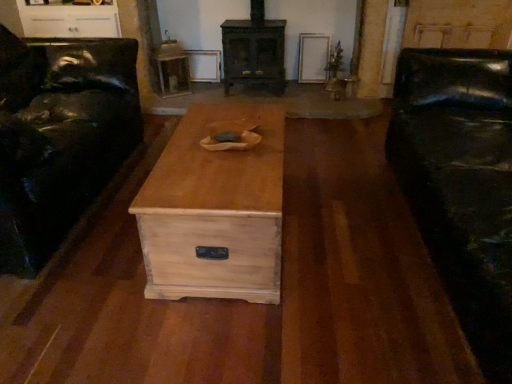
At what (x,y) coordinates should I click in order to perform the action: click on vacant space that is to the left of natural wood chest at center. Please return your answer as a coordinate pair (x, y). The height and width of the screenshot is (384, 512). Looking at the image, I should click on (95, 244).